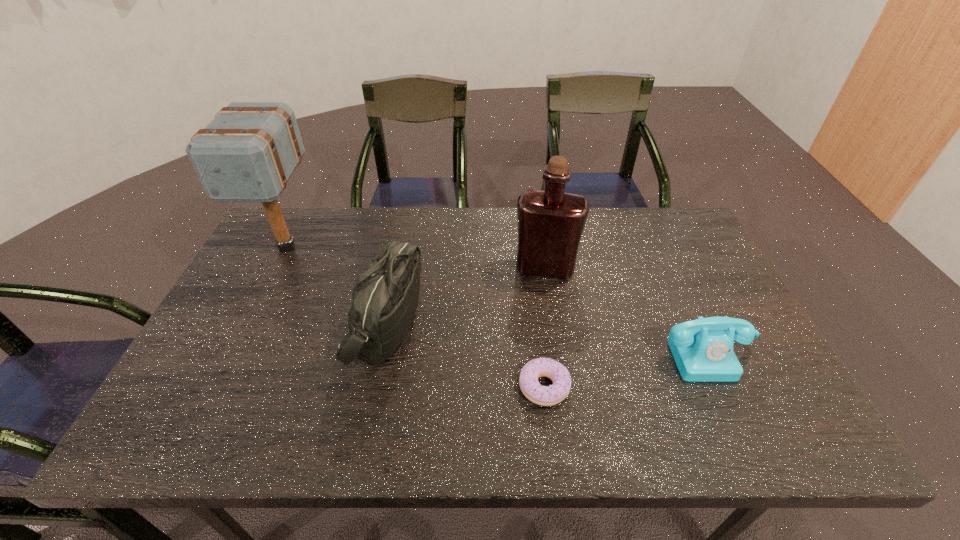
The image size is (960, 540). I want to click on the leftmost object, so click(x=248, y=152).

At what (x,y) coordinates should I click in order to perform the action: click on liquor. Please return your answer as a coordinate pair (x, y). The image size is (960, 540). Looking at the image, I should click on (550, 222).

You are a GUI agent. You are given a task and a screenshot of the screen. Output one action in this format:
    pyautogui.click(x=<x>, y=<y>)
    Task: Click on the second object from left to right
    This screenshot has width=960, height=540.
    Given the screenshot: What is the action you would take?
    pyautogui.click(x=385, y=297)

Find the location of a particular element. the third shortest object is located at coordinates (385, 297).

Find the location of a particular element. The width and height of the screenshot is (960, 540). telephone is located at coordinates (703, 351).

Locate an element on the screen. The width and height of the screenshot is (960, 540). the rightmost object is located at coordinates (703, 351).

Identify the location of the shortest object. (553, 394).

In order to click on vacant area located 0.140m on the striking surface of the mallet in this screenshot , I will do `click(254, 312)`.

You are a GUI agent. You are given a task and a screenshot of the screen. Output one action in this format:
    pyautogui.click(x=<x>, y=<y>)
    Task: Click on the vacant space located 0.260m on the right of the liquor
    Image resolution: width=960 pixels, height=540 pixels.
    Given the screenshot: What is the action you would take?
    pyautogui.click(x=664, y=267)

Where is `free space located at the front padded panel of the shoulder bag`? free space located at the front padded panel of the shoulder bag is located at coordinates (449, 325).